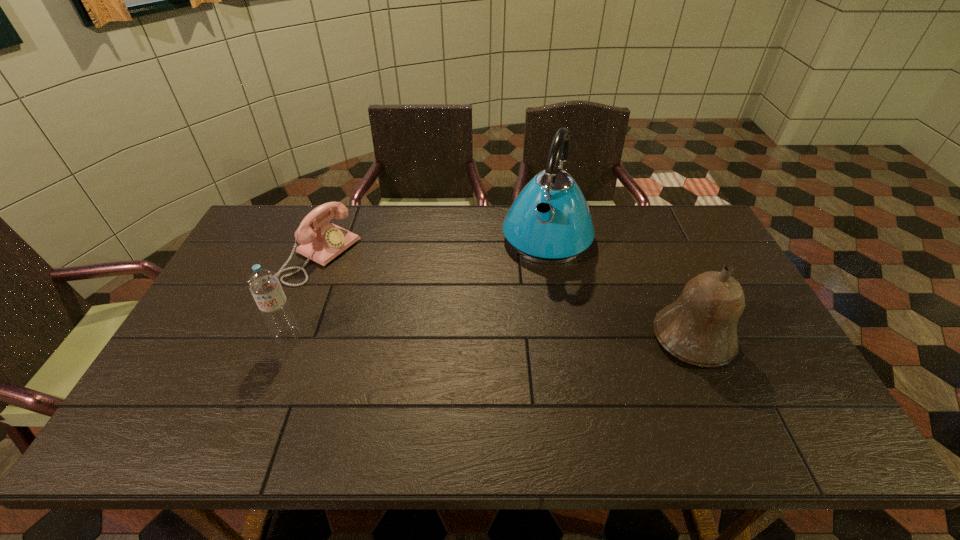
Find the location of `blank space located 0.360m at the spout of the kettle`. blank space located 0.360m at the spout of the kettle is located at coordinates (501, 355).

This screenshot has height=540, width=960. Find the location of `blank area located 0.260m at the spout of the kettle`. blank area located 0.260m at the spout of the kettle is located at coordinates (512, 327).

The width and height of the screenshot is (960, 540). Find the location of `vacant area situated at the spout of the kettle`. vacant area situated at the spout of the kettle is located at coordinates (524, 295).

Image resolution: width=960 pixels, height=540 pixels. What are the coordinates of `telephone that is at the far edge` in the screenshot? It's located at (326, 241).

You are a GUI agent. You are given a task and a screenshot of the screen. Output one action in this format:
    pyautogui.click(x=<x>, y=<y>)
    Task: Click on the kettle located at the far edge
    The image size is (960, 540).
    Given the screenshot: What is the action you would take?
    pyautogui.click(x=549, y=222)

I want to click on object that is at the left edge, so click(326, 241).

This screenshot has height=540, width=960. I want to click on object that is at the right edge, so click(700, 327).

Locate an element on the screen. This screenshot has height=540, width=960. object at the far left corner is located at coordinates (326, 241).

In order to click on vacant space at the far edge of the desktop in this screenshot , I will do `click(460, 210)`.

Image resolution: width=960 pixels, height=540 pixels. Find the location of `vacant space at the near edge`. vacant space at the near edge is located at coordinates (252, 386).